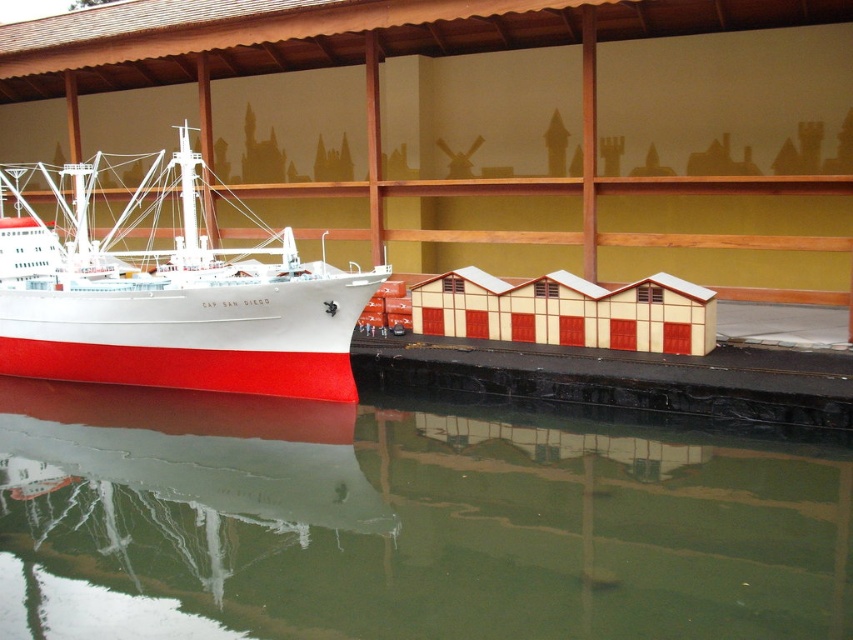
Find the location of a particular element. green reflective water at lower center is located at coordinates (401, 524).

Between point (112, 404) and point (93, 182), which one is positioned in front?

Positioned in front is point (112, 404).

This screenshot has width=853, height=640. What are the coordinates of `green reflective water at lower center` in the screenshot? It's located at (401, 524).

The width and height of the screenshot is (853, 640). I want to click on black rubber dock at lower center, so click(619, 378).

You are a GUI agent. You are given a task and a screenshot of the screen. Output one action in this format:
    pyautogui.click(x=<x>, y=<y>)
    Task: Click on the black rubber dock at lower center
    This screenshot has width=853, height=640.
    Given the screenshot: What is the action you would take?
    pyautogui.click(x=619, y=378)

Locate an element on the screen. black rubber dock at lower center is located at coordinates (619, 378).

Does green reflective water at lower center have a larger size compared to beige matte/beige textured building at lower center?

Correct, green reflective water at lower center is larger in size than beige matte/beige textured building at lower center.

Between point (752, 600) and point (440, 291), which one is positioned behind?

Point (440, 291)

Where is `green reflective water at lower center`? Image resolution: width=853 pixels, height=640 pixels. green reflective water at lower center is located at coordinates (401, 524).